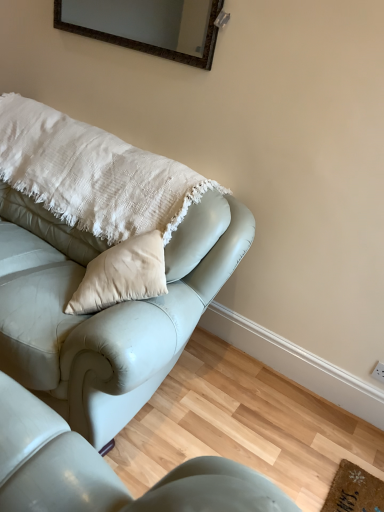
This screenshot has width=384, height=512. In order to click on free point below matte brown frame at upper center (from a real-world perspective) in this screenshot , I will do `click(122, 118)`.